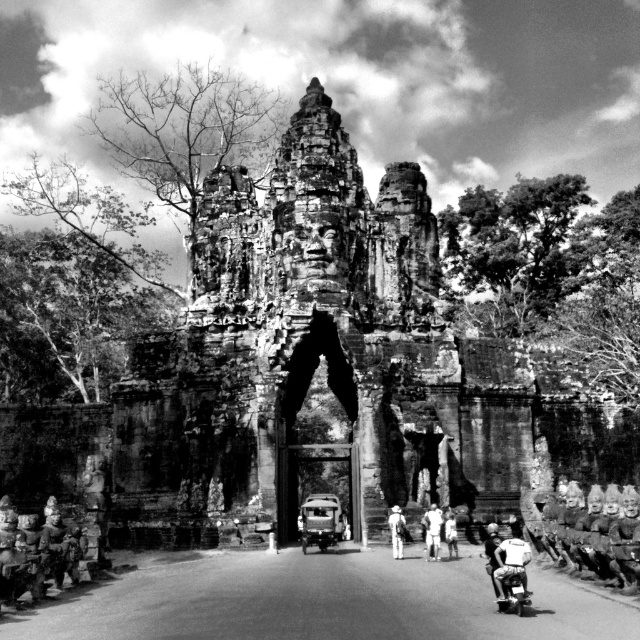
The width and height of the screenshot is (640, 640). I want to click on white cotton shirt at center, so click(x=433, y=531).

Between white cotton shirt at center and white fabric hat at center, which one is positioned higher?

white fabric hat at center is above.

Image resolution: width=640 pixels, height=640 pixels. I want to click on white cotton shirt at center, so point(433,531).

Locate an element on the screen. The image size is (640, 640). white cotton shirt at center is located at coordinates (433, 531).

Can you confirm if white fabric shirt at lower center is shorter than white fabric hat at center?

No.

Measure the distance from white fabric shirt at lower center to white fabric hat at center.

A distance of 18.11 meters exists between white fabric shirt at lower center and white fabric hat at center.

Does point (502, 595) come behind point (397, 532)?

That is False.

Find the location of `white fabric shirt at lower center`. white fabric shirt at lower center is located at coordinates (509, 563).

Is white fabric hat at center taller than light skin/white fabric person at center?

No.

Which is above, white fabric hat at center or light skin/white fabric person at center?

white fabric hat at center

What do you see at coordinates (396, 531) in the screenshot? The width and height of the screenshot is (640, 640). I see `white fabric hat at center` at bounding box center [396, 531].

The height and width of the screenshot is (640, 640). Find the location of `white fabric hat at center`. white fabric hat at center is located at coordinates (396, 531).